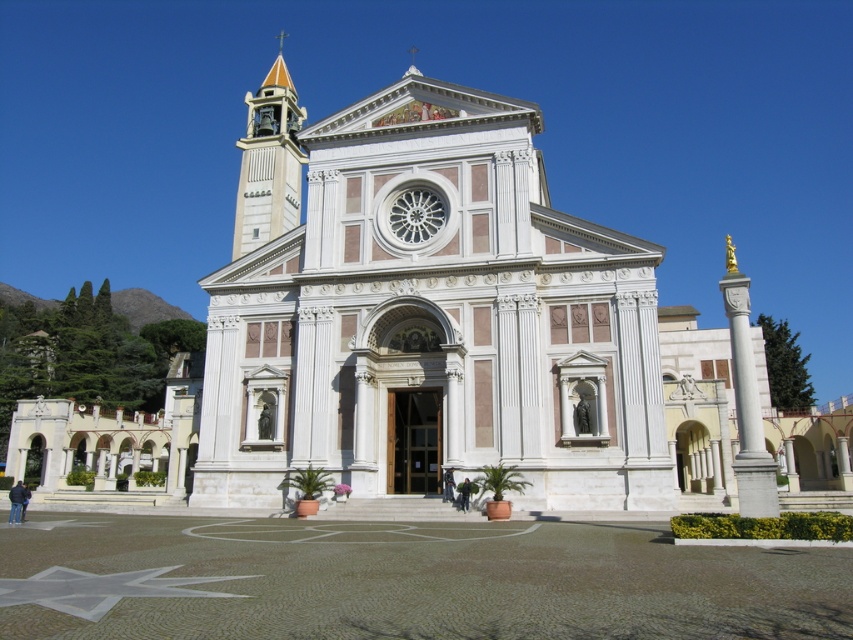
Question: Observing the image, what is the correct spatial positioning of matte orange bell tower at upper left in reference to black leather jacket at center?

Choices:
 (A) right
 (B) left

Answer: (B)

Question: Can you confirm if dark gray fabric jacket at lower center is wider than black leather jacket at center?

Choices:
 (A) yes
 (B) no

Answer: (A)

Question: Which point is farther to the camera?

Choices:
 (A) (16, 500)
 (B) (448, 492)
 (C) (463, 506)

Answer: (B)

Question: Based on their relative distances, which object is farther from the matte orange bell tower at upper left?

Choices:
 (A) dark blue jacket at lower left
 (B) black leather jacket at center

Answer: (A)

Question: Considering the real-world distances, which object is farthest from the dark blue jacket at lower left?

Choices:
 (A) dark gray fabric jacket at lower center
 (B) matte orange bell tower at upper left
 (C) black leather jacket at center

Answer: (B)

Question: Can you confirm if matte orange bell tower at upper left is positioned to the right of dark gray fabric jacket at lower center?

Choices:
 (A) yes
 (B) no

Answer: (B)